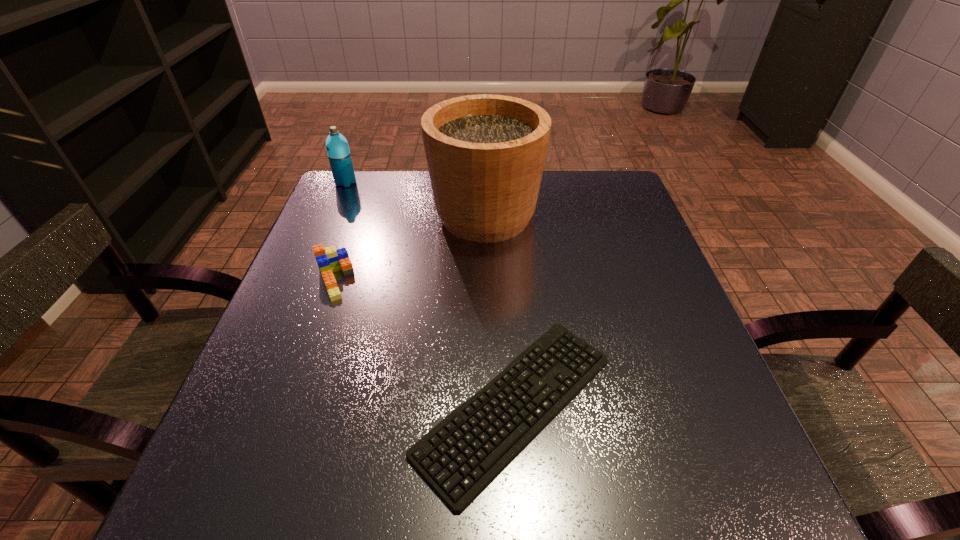
Find the location of `vacant space at the near left corner of the desktop`. vacant space at the near left corner of the desktop is located at coordinates (272, 514).

This screenshot has width=960, height=540. I want to click on free space at the far right corner of the desktop, so click(x=571, y=187).

This screenshot has width=960, height=540. I want to click on vacant space at the near right corner of the desktop, so click(748, 477).

Locate an element on the screen. The height and width of the screenshot is (540, 960). vacant area that lies between the tallest object and the third shortest object is located at coordinates (416, 199).

Where is `empty location between the flowerpot and the third tallest object`? empty location between the flowerpot and the third tallest object is located at coordinates (409, 248).

Locate an element on the screen. This screenshot has width=960, height=540. vacant space in between the nearest object and the flowerpot is located at coordinates (500, 310).

At what (x,y) coordinates should I click in order to perform the action: click on free space between the second tallest object and the shortest object. Please return your answer as a coordinate pair (x, y). This screenshot has height=540, width=960. Looking at the image, I should click on (431, 294).

This screenshot has height=540, width=960. In order to click on vacant space in between the second tallest object and the shortest object in this screenshot , I will do `click(431, 294)`.

The width and height of the screenshot is (960, 540). What are the coordinates of `vacant area that lies between the flowerpot and the second nearest object` in the screenshot? It's located at [409, 248].

Identify the location of vacant area that lies between the third shortest object and the Lego. This screenshot has height=540, width=960. (340, 231).